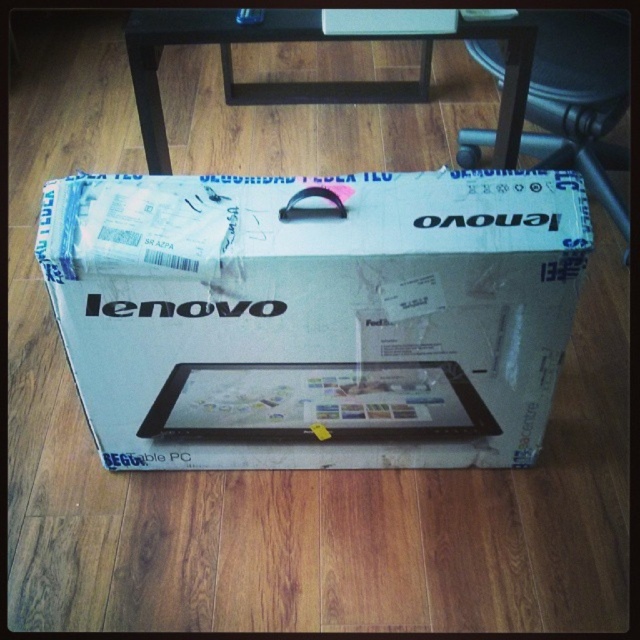
Question: Is white cardboard box at center bigger than matte black tablet at center?

Choices:
 (A) no
 (B) yes

Answer: (B)

Question: Which of these objects is positioned farthest from the white cardboard box at center?

Choices:
 (A) matte black tablet at center
 (B) wooden stool at center

Answer: (B)

Question: Which point is farther to the camera?

Choices:
 (A) (381, 268)
 (B) (472, 385)
 (C) (627, 212)

Answer: (C)

Question: Which point is farther to the camera?

Choices:
 (A) wooden stool at center
 (B) white cardboard box at center
 (C) matte black tablet at center

Answer: (A)

Question: Is matte black tablet at center closer to the viewer compared to wooden stool at center?

Choices:
 (A) no
 (B) yes

Answer: (B)

Question: Can you confirm if matte black tablet at center is positioned below wooden stool at center?

Choices:
 (A) no
 (B) yes

Answer: (B)